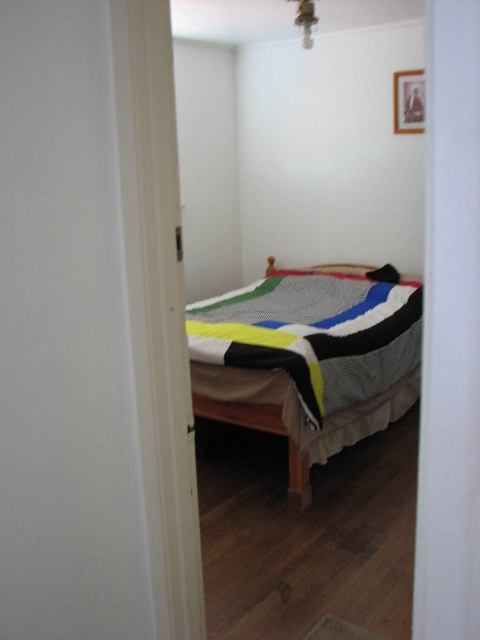
Between knitted fabric bed at center and black fabric pillow at center, which one is positioned lower?

knitted fabric bed at center is lower down.

Find the location of a particular element. The width and height of the screenshot is (480, 640). knitted fabric bed at center is located at coordinates (308, 358).